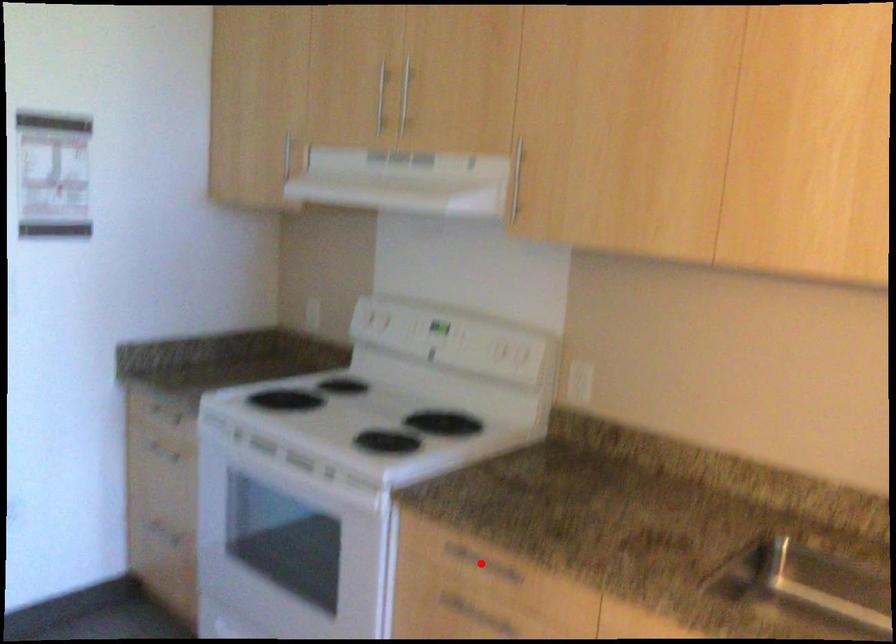
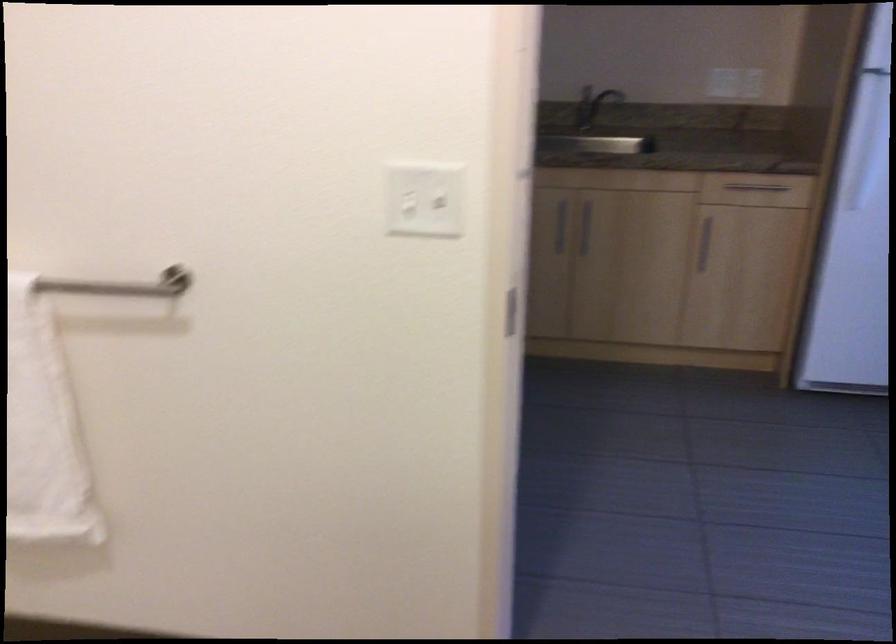
Question: I am providing you with two images of the same scene from different viewpoints. A red point is marked on the first image. Can you still see the location of the red point in image 2?

Choices:
 (A) Yes
 (B) No

Answer: (B)